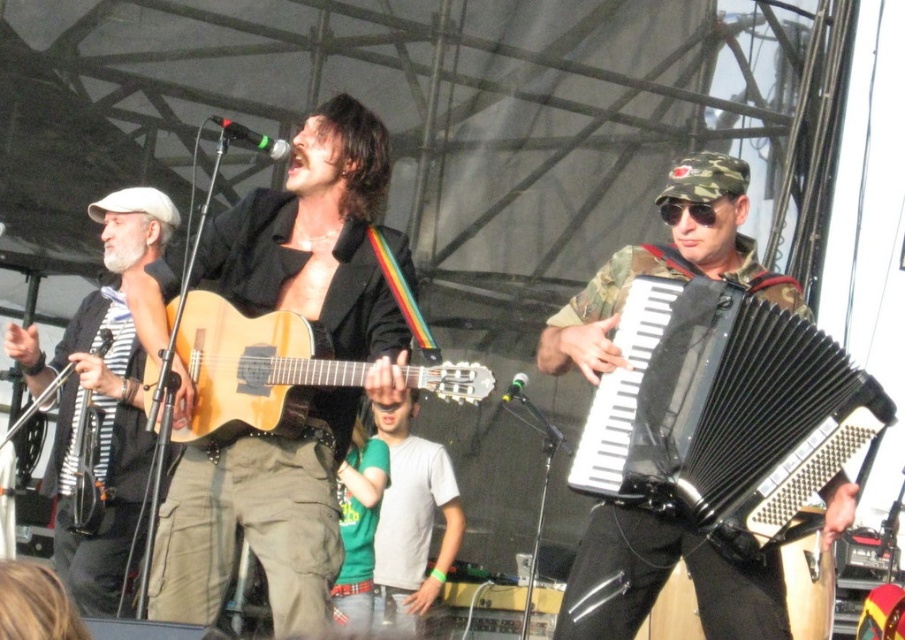
You are a photographer at the event and want to capture both the black rubber accordion at right and the white striped shirt at left in the same frame. Which object should you focus on first to ensure both are in the frame?

The black rubber accordion at right is shorter than the white striped shirt at left. To include both in the frame, focus on the white striped shirt at left first as it is taller, ensuring the shorter black rubber accordion at right will also be captured.

Based on the scene description, which object is bigger between the white striped shirt at left and the natural wood acoustic guitar at center?

The white striped shirt at left is larger than the natural wood acoustic guitar at center according to the description.

Based on the scene description, which musical instrument is bigger between the black rubber accordion at right and the natural wood acoustic guitar at center?

The black rubber accordion at right is larger in size compared to the natural wood acoustic guitar at center according to the description.